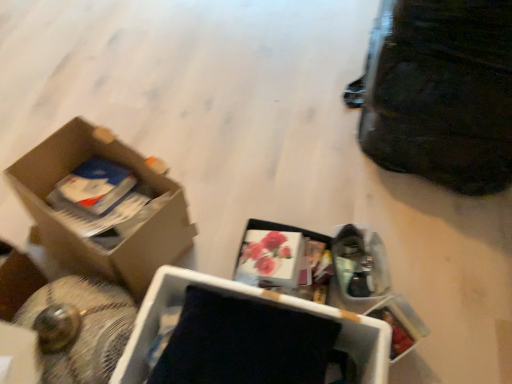
Question: From a real-world perspective, is cardboard box at left, acting as the 2th box starting from the right, above or below black matte box at center, which is the second box from left to right?

Choices:
 (A) above
 (B) below

Answer: (A)

Question: Is cardboard box at left, acting as the 2th box starting from the right, to the left or to the right of black matte box at center, which is the second box from left to right, in the image?

Choices:
 (A) right
 (B) left

Answer: (B)

Question: Which is nearer to the black matte box at center, acting as the first box starting from the right?

Choices:
 (A) black leather bag at upper right
 (B) cardboard box at left, acting as the 2th box starting from the right

Answer: (B)

Question: Which of these objects is positioned farthest from the black matte box at center, which is the second box from left to right?

Choices:
 (A) cardboard box at left, acting as the 2th box starting from the right
 (B) black leather bag at upper right

Answer: (B)